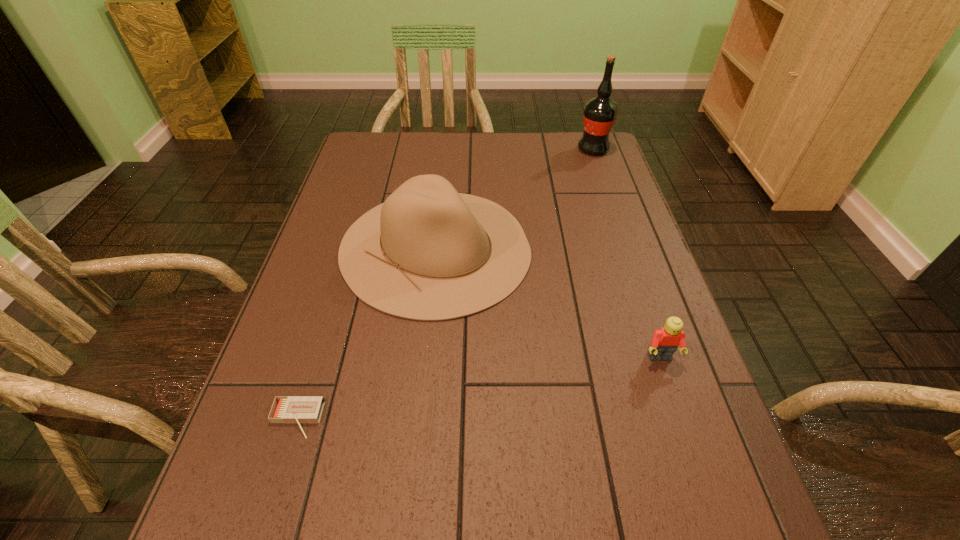
This screenshot has width=960, height=540. In order to click on the sixth closest object to the third biggest yellow sunflower in this screenshot , I will do `click(654, 401)`.

Locate an element on the screen. Image resolution: width=960 pixels, height=540 pixels. the third closest sunflower to the tallest sunflower is located at coordinates (356, 288).

Find the location of a particular element. The width and height of the screenshot is (960, 540). the fourth closest sunflower to the third yellow sunflower from left to right is located at coordinates (356, 288).

Locate an element on the screen. Image resolution: width=960 pixels, height=540 pixels. the closest yellow sunflower relative to the third smallest yellow sunflower is located at coordinates (426, 155).

Point out which yellow sunflower is positioned as the nearest to the third biggest yellow sunflower. Please provide its 2D coordinates. Your answer should be formatted as a tuple, i.e. [(x, y)], where the tuple contains the x and y coordinates of a point satisfying the conditions above.

[(529, 178)]

Locate which green sunflower ranks second in proximity to the second smallest yellow sunflower. Please provide its 2D coordinates. Your answer should be formatted as a tuple, i.e. [(x, y)], where the tuple contains the x and y coordinates of a point satisfying the conditions above.

[(613, 293)]

Select which green sunflower appears as the second closest to the third yellow sunflower from left to right. Please provide its 2D coordinates. Your answer should be formatted as a tuple, i.e. [(x, y)], where the tuple contains the x and y coordinates of a point satisfying the conditions above.

[(613, 293)]

Identify the location of vacant region that satisfies the following two spatial constraints: 1. on the front-facing side of the second yellow sunflower from right to left; 2. on the front-facing side of the second nearest yellow sunflower. (546, 304).

The width and height of the screenshot is (960, 540). Identify the location of free spot that satisfies the following two spatial constraints: 1. on the face of the right green sunflower; 2. on the front-facing side of the yellow sponge. (660, 470).